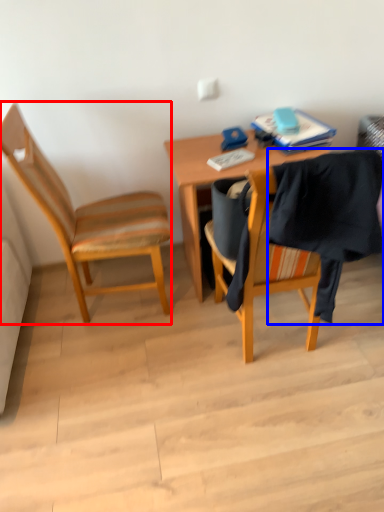
Question: Which object appears closest to the camera in this image, chair (highlighted by a red box) or clothe (highlighted by a blue box)?

Choices:
 (A) chair
 (B) clothe

Answer: (B)